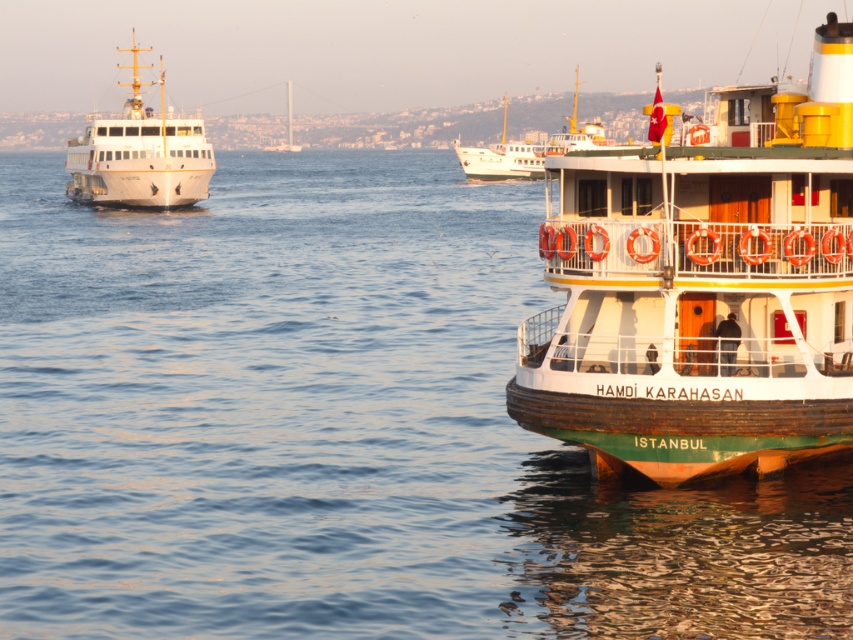
Question: Does wooden ship at right come in front of white matte boat at center?

Choices:
 (A) yes
 (B) no

Answer: (A)

Question: Does wooden ship at right come in front of white glossy ferry at upper left?

Choices:
 (A) no
 (B) yes

Answer: (B)

Question: Which point is closer to the camera taking this photo?

Choices:
 (A) (825, 224)
 (B) (540, 173)

Answer: (A)

Question: Among these objects, which one is nearest to the camera?

Choices:
 (A) white matte boat at center
 (B) wooden ship at right

Answer: (B)

Question: Can you confirm if wooden ship at right is thinner than white matte boat at center?

Choices:
 (A) yes
 (B) no

Answer: (A)

Question: Estimate the real-world distances between objects in this image. Which object is farther from the white matte boat at center?

Choices:
 (A) wooden ship at right
 (B) white glossy ferry at upper left

Answer: (A)